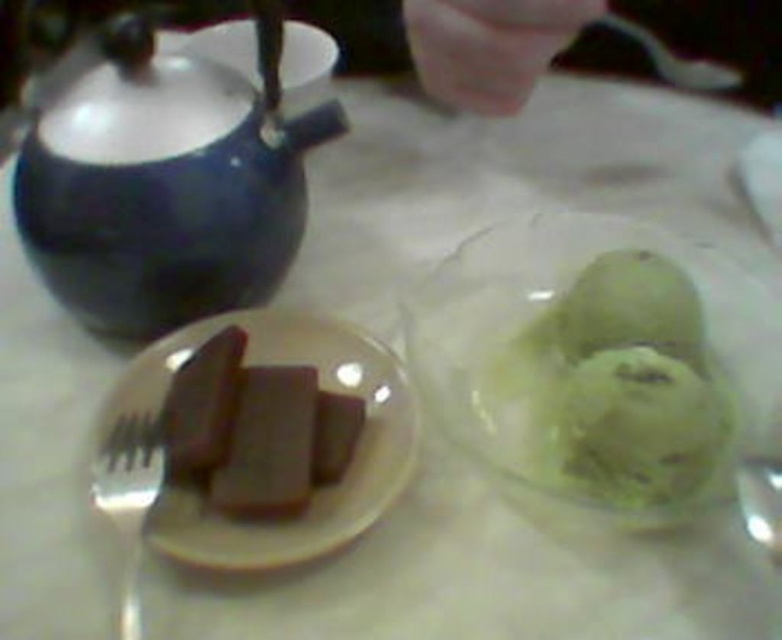
You are a server arranging the table. You need to place a new decorative item between the matte brown chocolate at left and the metallic spoon at upper right. Based on their positions, where should you place the item to ensure it is between them?

The matte brown chocolate at left is in front of the metallic spoon at upper right, so placing the decorative item between them would require positioning it closer to the chocolate but still behind it, ensuring it is between the two objects along the depth axis.

In the scene shown: You are a chef trying to determine if the dark brown chocolate at center can fit into a container designed for the silver metallic fork at lower left. Based on their sizes, will the chocolate fit?

The dark brown chocolate at center has a larger width than the silver metallic fork at lower left, so it will not fit into a container designed for the fork.

You are a food critic evaluating the table setting. You need to describe the relative heights of the dark brown chocolate at center and the silver metallic fork at lower left. Which one is taller?

The dark brown chocolate at center is shorter than the silver metallic fork at lower left, so the silver metallic fork at lower left is taller.